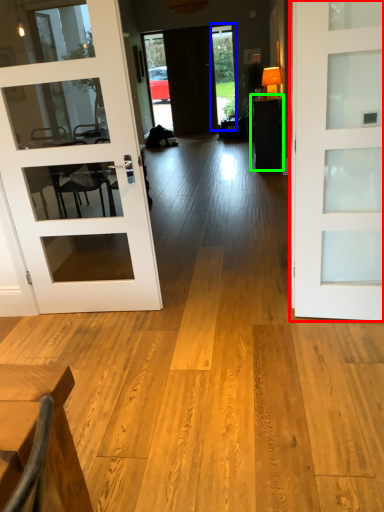
Question: Estimate the real-world distances between objects in this image. Which object is closer to door (highlighted by a red box), window (highlighted by a blue box) or table (highlighted by a green box)?

Choices:
 (A) window
 (B) table

Answer: (B)